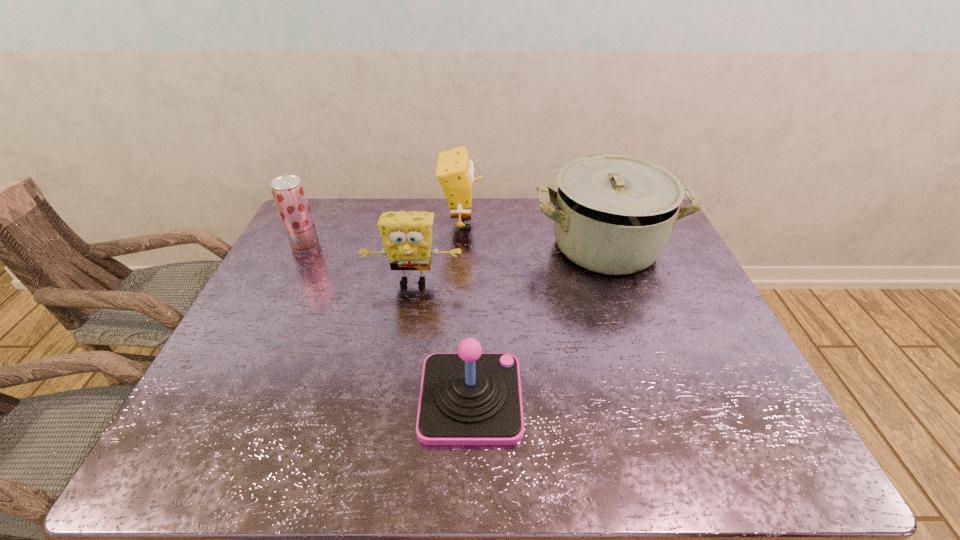
The image size is (960, 540). In the image, there is a desktop. What are the coordinates of `free space at the right edge` in the screenshot? It's located at (686, 297).

At what (x,y) coordinates should I click in order to perform the action: click on blank region between the nearest object and the nearer sponge. Please return your answer as a coordinate pair (x, y). Looking at the image, I should click on (442, 340).

This screenshot has width=960, height=540. In order to click on free space between the rightmost object and the farther sponge in this screenshot , I will do `click(534, 234)`.

Find the location of `empty space that is in between the saucepan and the nearest object`. empty space that is in between the saucepan and the nearest object is located at coordinates (539, 322).

This screenshot has height=540, width=960. I want to click on free area in between the nearer sponge and the rightmost object, so click(x=510, y=264).

The height and width of the screenshot is (540, 960). Identify the location of free space between the rightmost object and the leftmost object. (456, 246).

At what (x,y) coordinates should I click in order to perform the action: click on free space between the rightmost object and the fruit juice. Please return your answer as a coordinate pair (x, y). Looking at the image, I should click on (456, 246).

Where is `unoccupied area between the nearer sponge and the fruit juice`? unoccupied area between the nearer sponge and the fruit juice is located at coordinates (359, 264).

Locate an element on the screen. The image size is (960, 540). vacant point located between the joystick and the rightmost object is located at coordinates (539, 322).

At what (x,y) coordinates should I click in order to perform the action: click on object that is the fourth nearest to the shortest object. Please return your answer as a coordinate pair (x, y). Looking at the image, I should click on (288, 191).